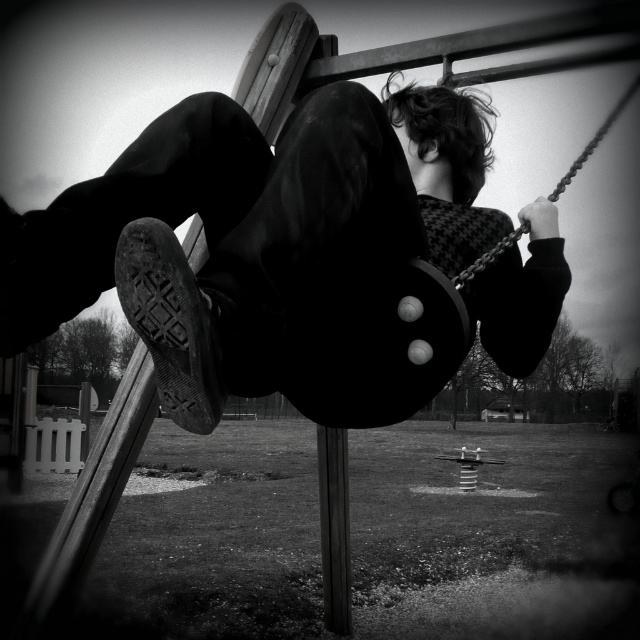
Question: Which point appears closest to the camera in this image?

Choices:
 (A) (346, 561)
 (B) (234, 132)

Answer: (B)

Question: Is dark fabric pants at center thinner than smooth wood pole at center?

Choices:
 (A) yes
 (B) no

Answer: (B)

Question: Does dark fabric pants at center have a greater width compared to smooth wood pole at center?

Choices:
 (A) no
 (B) yes

Answer: (B)

Question: Which of the following is the farthest from the observer?

Choices:
 (A) smooth wood pole at center
 (B) dark fabric pants at center

Answer: (A)

Question: Which point is closer to the camera taking this photo?

Choices:
 (A) (488, 244)
 (B) (333, 506)

Answer: (A)

Question: Is dark fabric pants at center above smooth wood pole at center?

Choices:
 (A) yes
 (B) no

Answer: (A)